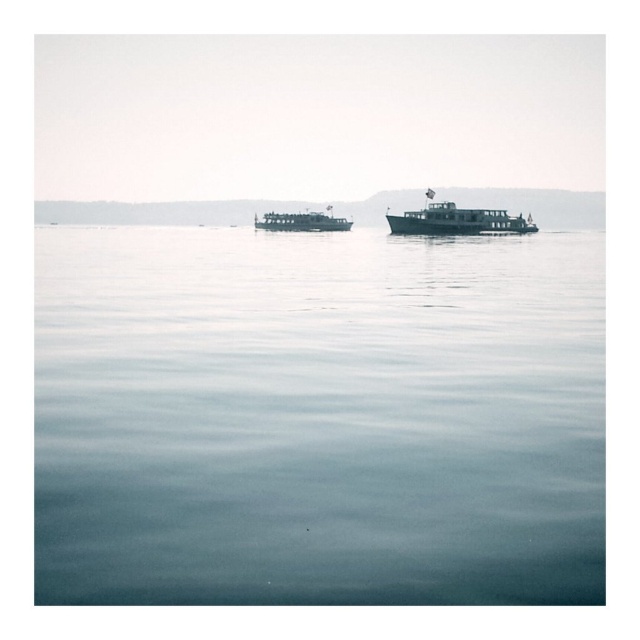
Question: Considering the relative positions of clear water at center and green matte boat at center in the image provided, where is clear water at center located with respect to green matte boat at center?

Choices:
 (A) below
 (B) above

Answer: (A)

Question: Which of these objects is positioned closest to the metallic silver ferry at center?

Choices:
 (A) green matte boat at center
 (B) clear water at center

Answer: (A)

Question: Can you confirm if clear water at center is positioned above metallic silver ferry at center?

Choices:
 (A) yes
 (B) no

Answer: (B)

Question: Which of the following is the farthest from the observer?

Choices:
 (A) (x=330, y=227)
 (B) (x=496, y=216)

Answer: (A)

Question: Which object appears closest to the camera in this image?

Choices:
 (A) green matte boat at center
 (B) metallic silver ferry at center
 (C) clear water at center

Answer: (C)

Question: From the image, what is the correct spatial relationship of green matte boat at center in relation to metallic silver ferry at center?

Choices:
 (A) above
 (B) below

Answer: (B)